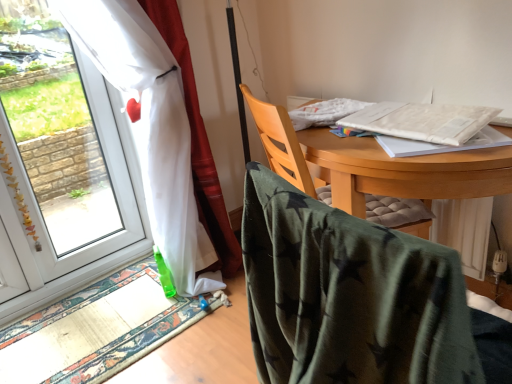
This screenshot has width=512, height=384. Describe the element at coordinates (283, 146) in the screenshot. I see `wooden chair at center, which appears as the 2th chair when viewed from the front` at that location.

How much space does white paper at upper right, placed as the first notebook when sorted from bottom to top, occupy vertically?

0.80 inches.

Find the location of a particular element. This screenshot has height=384, width=512. white sheer curtain at left is located at coordinates (151, 128).

Find the location of a particular element. The image size is (512, 384). wooden chair at center, which is counted as the first chair, starting from the back is located at coordinates (283, 146).

Who is more distant, white sheer curtain at left or green velvety chair at center, positioned as the 1th chair in front-to-back order?

white sheer curtain at left is behind.

In the scene shown: Considering the relative sizes of white sheer curtain at left and green velvety chair at center, which is the 2th chair from back to front, in the image provided, is white sheer curtain at left smaller than green velvety chair at center, which is the 2th chair from back to front,?

No.

Who is taller, white sheer curtain at left or green velvety chair at center, positioned as the 1th chair in front-to-back order?

With more height is white sheer curtain at left.

Between green velvety chair at center, which is the 2th chair from back to front, and white matte notebook at upper right, which appears as the 1th notebook when viewed from the top, which one appears on the left side from the viewer's perspective?

From the viewer's perspective, green velvety chair at center, which is the 2th chair from back to front, appears more on the left side.

Considering the relative sizes of green velvety chair at center, which is the 2th chair from back to front, and white matte notebook at upper right, which appears as the 1th notebook when viewed from the top, in the image provided, is green velvety chair at center, which is the 2th chair from back to front, wider than white matte notebook at upper right, which appears as the 1th notebook when viewed from the top,?

Yes.

From a real-world perspective, who is located lower, green velvety chair at center, which is the 2th chair from back to front, or white matte notebook at upper right, which appears as the 1th notebook when viewed from the top?

green velvety chair at center, which is the 2th chair from back to front, is physically lower.

Is white matte notebook at upper right, which appears as the 1th notebook when viewed from the top, at the back of green velvety chair at center, positioned as the 1th chair in front-to-back order?

No, green velvety chair at center, positioned as the 1th chair in front-to-back order,'s orientation is not away from white matte notebook at upper right, which appears as the 1th notebook when viewed from the top.

Is the surface of transparent glass window at left in direct contact with white paper at upper right, placed as the first notebook when sorted from bottom to top?

They are not placed beside each other.

Looking at the image, does transparent glass window at left seem bigger or smaller compared to white paper at upper right, which ranks as the second notebook in top-to-bottom order?

In the image, transparent glass window at left appears to be larger than white paper at upper right, which ranks as the second notebook in top-to-bottom order.

I want to click on window behind the white paper at upper right, which ranks as the second notebook in top-to-bottom order, so click(58, 154).

From a real-world perspective, is transparent glass window at left positioned above or below white paper at upper right, which ranks as the second notebook in top-to-bottom order?

In terms of real-world spatial position, transparent glass window at left is below white paper at upper right, which ranks as the second notebook in top-to-bottom order.

From a real-world perspective, is white matte notebook at upper right, arranged as the second notebook when ordered from the bottom, above or below transparent glass window at left?

white matte notebook at upper right, arranged as the second notebook when ordered from the bottom, is situated higher than transparent glass window at left in the real world.

Can you confirm if white matte notebook at upper right, arranged as the second notebook when ordered from the bottom, is positioned to the left of transparent glass window at left?

In fact, white matte notebook at upper right, arranged as the second notebook when ordered from the bottom, is to the right of transparent glass window at left.

From the transparent glass window at left, count 1st notebook to the right and point to it. Please provide its 2D coordinates.

[(422, 121)]

From the image's perspective, is white matte notebook at upper right, which appears as the 1th notebook when viewed from the top, positioned above or below transparent glass window at left?

white matte notebook at upper right, which appears as the 1th notebook when viewed from the top, is above transparent glass window at left.

Consider the image. Which is correct: wooden chair at center, which is counted as the first chair, starting from the back, is inside transparent glass window at left, or outside of it?

wooden chair at center, which is counted as the first chair, starting from the back, exists outside the volume of transparent glass window at left.

Between wooden chair at center, which appears as the 2th chair when viewed from the front, and transparent glass window at left, which one appears on the right side from the viewer's perspective?

wooden chair at center, which appears as the 2th chair when viewed from the front.

Does point (407, 222) appear closer or farther from the camera than point (123, 241)?

Point (407, 222) appears to be closer to the viewer than point (123, 241).

Which object is more forward, wooden chair at center, which appears as the 2th chair when viewed from the front, or transparent glass window at left?

wooden chair at center, which appears as the 2th chair when viewed from the front.

Which object is positioned more to the left, white matte notebook at upper right, which appears as the 1th notebook when viewed from the top, or white paper at upper right, which ranks as the second notebook in top-to-bottom order?

white matte notebook at upper right, which appears as the 1th notebook when viewed from the top.

Which of these two, white matte notebook at upper right, which appears as the 1th notebook when viewed from the top, or white paper at upper right, placed as the first notebook when sorted from bottom to top, is smaller?

Smaller between the two is white paper at upper right, placed as the first notebook when sorted from bottom to top.

Is white matte notebook at upper right, arranged as the second notebook when ordered from the bottom, aimed at white paper at upper right, which ranks as the second notebook in top-to-bottom order?

No.

In order to click on window located above the green fabric mat at lower left (from the image's perspective) in this screenshot , I will do `click(58, 154)`.

From a real-world perspective, is transparent glass window at left located beneath green fabric mat at lower left?

Incorrect, from a real-world perspective, transparent glass window at left is higher than green fabric mat at lower left.

Is transparent glass window at left at the left side of green fabric mat at lower left?

Yes.

Is transparent glass window at left completely or partially outside of green fabric mat at lower left?

Yes.

Identify the location of curtain behind the green velvety chair at center, positioned as the 1th chair in front-to-back order. (151, 128).

I want to click on the 1st chair to the left when counting from the white matte notebook at upper right, arranged as the second notebook when ordered from the bottom, so click(x=357, y=298).

Considering their positions, is white matte notebook at upper right, arranged as the second notebook when ordered from the bottom, positioned closer to wooden chair at center, which appears as the 2th chair when viewed from the front, than white paper at upper right, which ranks as the second notebook in top-to-bottom order?

white matte notebook at upper right, arranged as the second notebook when ordered from the bottom, is closer to wooden chair at center, which appears as the 2th chair when viewed from the front.

Estimate the real-world distances between objects in this image. Which object is further from white sheer curtain at left, white matte notebook at upper right, arranged as the second notebook when ordered from the bottom, or green velvety chair at center, positioned as the 1th chair in front-to-back order?

Based on the image, green velvety chair at center, positioned as the 1th chair in front-to-back order, appears to be further to white sheer curtain at left.

When comparing their distances from transparent glass window at left, does wooden chair at center, which is counted as the first chair, starting from the back, or white sheer curtain at left seem further?

The object further to transparent glass window at left is wooden chair at center, which is counted as the first chair, starting from the back.

Estimate the real-world distances between objects in this image. Which object is further from transparent glass window at left, white paper at upper right, which ranks as the second notebook in top-to-bottom order, or wooden chair at center, which is counted as the first chair, starting from the back?

white paper at upper right, which ranks as the second notebook in top-to-bottom order, lies further to transparent glass window at left than the other object.

Considering their positions, is green velvety chair at center, positioned as the 1th chair in front-to-back order, positioned further to white matte notebook at upper right, which appears as the 1th notebook when viewed from the top, than wooden chair at center, which appears as the 2th chair when viewed from the front?

green velvety chair at center, positioned as the 1th chair in front-to-back order, is further to white matte notebook at upper right, which appears as the 1th notebook when viewed from the top.

Based on their spatial positions, is green velvety chair at center, positioned as the 1th chair in front-to-back order, or transparent glass window at left further from wooden chair at center, which appears as the 2th chair when viewed from the front?

Based on the image, transparent glass window at left appears to be further to wooden chair at center, which appears as the 2th chair when viewed from the front.

Looking at the image, which one is located closer to green velvety chair at center, positioned as the 1th chair in front-to-back order, wooden chair at center, which is counted as the first chair, starting from the back, or green fabric mat at lower left?

The object closer to green velvety chair at center, positioned as the 1th chair in front-to-back order, is wooden chair at center, which is counted as the first chair, starting from the back.

Estimate the real-world distances between objects in this image. Which object is closer to green fabric mat at lower left, white paper at upper right, placed as the first notebook when sorted from bottom to top, or transparent glass window at left?

Among the two, white paper at upper right, placed as the first notebook when sorted from bottom to top, is located nearer to green fabric mat at lower left.

Locate an element on the screen. curtain between transparent glass window at left and green fabric mat at lower left from top to bottom is located at coordinates (151, 128).

Identify the location of curtain located between green fabric mat at lower left and green velvety chair at center, which is the 2th chair from back to front, in the left-right direction. This screenshot has height=384, width=512. (151, 128).

Locate an element on the screen. The height and width of the screenshot is (384, 512). curtain located between transparent glass window at left and wooden chair at center, which is counted as the first chair, starting from the back, in the left-right direction is located at coordinates [x=151, y=128].

Where is `curtain located between transparent glass window at left and white paper at upper right, which ranks as the second notebook in top-to-bottom order, in the left-right direction`? The height and width of the screenshot is (384, 512). curtain located between transparent glass window at left and white paper at upper right, which ranks as the second notebook in top-to-bottom order, in the left-right direction is located at coordinates (151, 128).